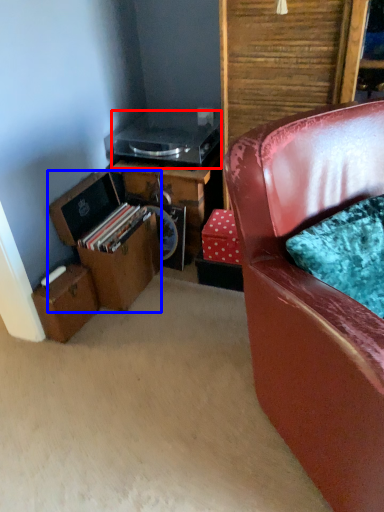
Question: Which point is closer to the camera, appliance (highlighted by a red box) or box (highlighted by a blue box)?

Choices:
 (A) appliance
 (B) box

Answer: (B)